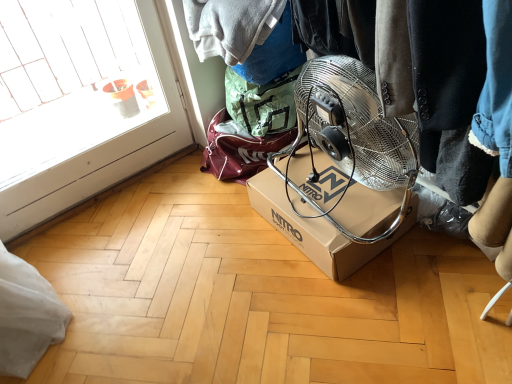
Locate an element on the screen. free space to the left of brown cardboard box at center is located at coordinates (227, 249).